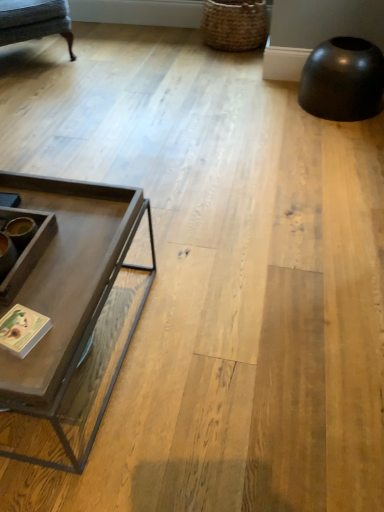
Question: From the image's perspective, is textured gray fabric swivel chair at upper left above or below woven brown basket at upper right?

Choices:
 (A) above
 (B) below

Answer: (B)

Question: Does point (28, 10) appear closer or farther from the camera than point (208, 33)?

Choices:
 (A) farther
 (B) closer

Answer: (B)

Question: Which of these objects is positioned farthest from the matte gray coffee table at left?

Choices:
 (A) woven brown basket at upper right
 (B) textured gray fabric swivel chair at upper left

Answer: (A)

Question: Considering the real-world distances, which object is closest to the textured gray fabric swivel chair at upper left?

Choices:
 (A) matte gray coffee table at left
 (B) woven brown basket at upper right

Answer: (B)